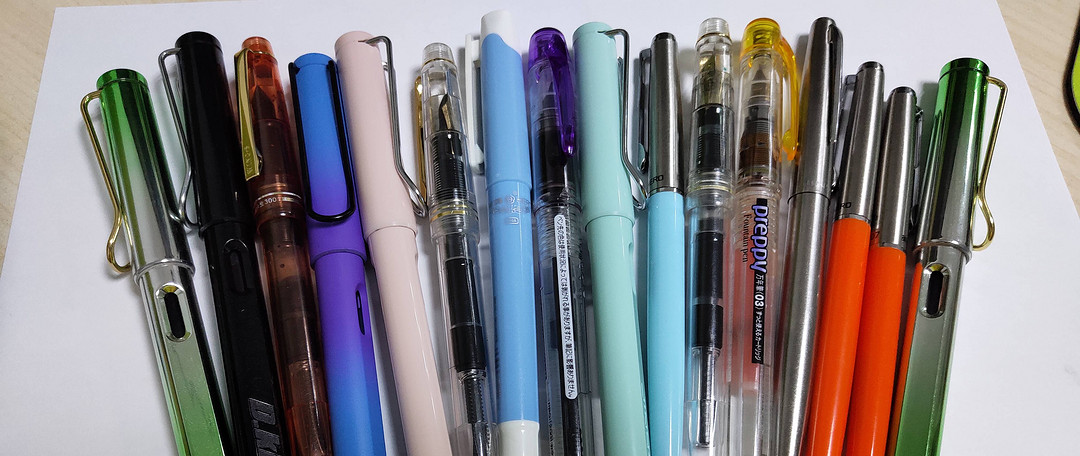
The width and height of the screenshot is (1080, 456). In order to click on clear case pens in this screenshot , I will do `click(456, 264)`, `click(713, 285)`, `click(764, 285)`, `click(559, 317)`.